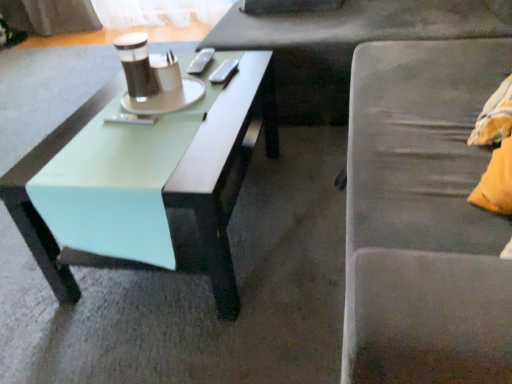
Question: Is the surface of matte black remote control at center, the 1th remote control viewed from the front, in direct contact with metallic silver remote control at center, which appears as the 2th remote control when viewed from the left?

Choices:
 (A) no
 (B) yes

Answer: (A)

Question: Is matte black remote control at center, arranged as the 1th remote control when viewed from the left, thinner than metallic silver remote control at center, placed as the third remote control when sorted from bottom to top?

Choices:
 (A) yes
 (B) no

Answer: (B)

Question: From the image's perspective, is matte black remote control at center, arranged as the 1th remote control when viewed from the left, below metallic silver remote control at center, acting as the first remote control starting from the back?

Choices:
 (A) no
 (B) yes

Answer: (B)

Question: Is matte black remote control at center, marked as the third remote control in a top-to-bottom arrangement, in front of metallic silver remote control at center, which ranks as the first remote control in top-to-bottom order?

Choices:
 (A) yes
 (B) no

Answer: (A)

Question: Does matte black remote control at center, positioned as the 3th remote control in back-to-front order, have a lesser height compared to metallic silver remote control at center, which appears as the third remote control when viewed from the front?

Choices:
 (A) no
 (B) yes

Answer: (B)

Question: In terms of height, does silver metallic remote control at center, the 1th remote control in the right-to-left sequence, look taller or shorter compared to matte black cup at center?

Choices:
 (A) short
 (B) tall

Answer: (A)

Question: Looking at the image, does silver metallic remote control at center, the 2th remote control in the top-to-bottom sequence, seem bigger or smaller compared to matte black cup at center?

Choices:
 (A) small
 (B) big

Answer: (A)

Question: From the image's perspective, relative to matte black cup at center, is silver metallic remote control at center, which ranks as the third remote control in left-to-right order, above or below?

Choices:
 (A) above
 (B) below

Answer: (A)

Question: Is silver metallic remote control at center, positioned as the 2th remote control in back-to-front order, in front of or behind matte black cup at center in the image?

Choices:
 (A) behind
 (B) front

Answer: (A)

Question: In terms of width, does silver metallic remote control at center, the 1th remote control in the right-to-left sequence, look wider or thinner when compared to mint green wood coffee table at left?

Choices:
 (A) wide
 (B) thin

Answer: (B)

Question: Does point (236, 59) appear closer or farther from the camera than point (27, 241)?

Choices:
 (A) closer
 (B) farther

Answer: (B)

Question: In terms of height, does silver metallic remote control at center, the 1th remote control in the right-to-left sequence, look taller or shorter compared to mint green wood coffee table at left?

Choices:
 (A) tall
 (B) short

Answer: (B)

Question: Which is correct: silver metallic remote control at center, positioned as the 2th remote control in back-to-front order, is inside mint green wood coffee table at left, or outside of it?

Choices:
 (A) inside
 (B) outside

Answer: (B)

Question: Is matte black remote control at center, arranged as the 1th remote control when ordered from the bottom, in front of or behind metallic silver remote control at center, which appears as the third remote control when viewed from the front, in the image?

Choices:
 (A) front
 (B) behind

Answer: (A)

Question: From the image's perspective, is matte black remote control at center, marked as the third remote control in a top-to-bottom arrangement, located above or below metallic silver remote control at center, which ranks as the first remote control in top-to-bottom order?

Choices:
 (A) above
 (B) below

Answer: (B)